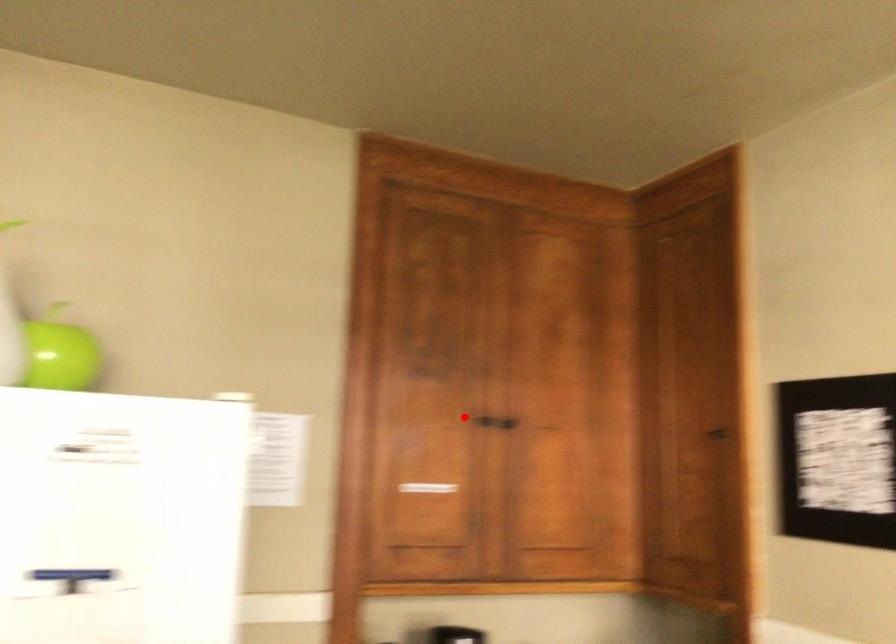
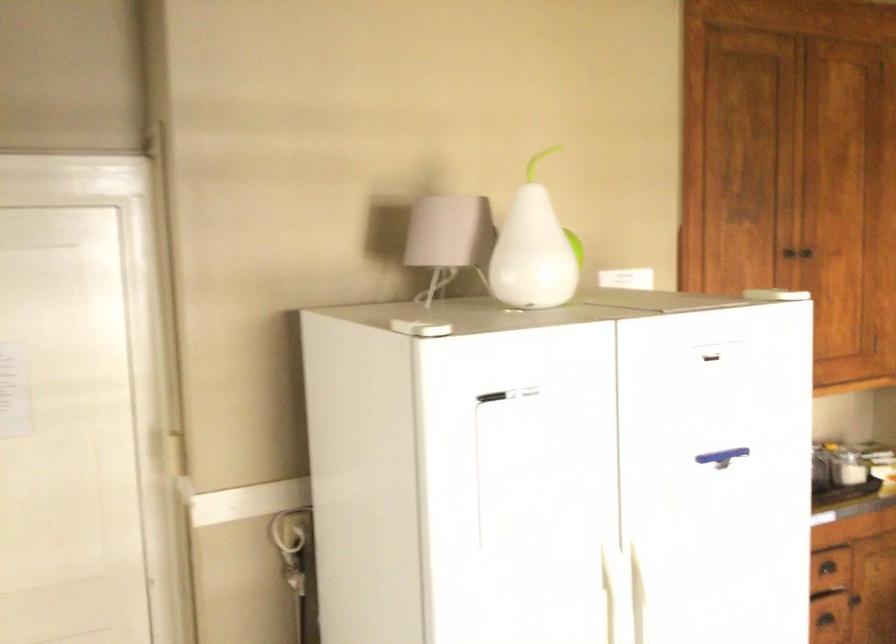
In the second image, find the point that corresponds to the highlighted location in the first image.

(786, 257)